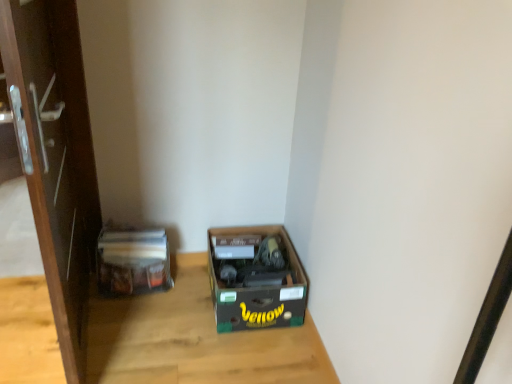
Find the location of a particular element. The width and height of the screenshot is (512, 384). vacant position to the left of brown cardboard box at lower center is located at coordinates (169, 310).